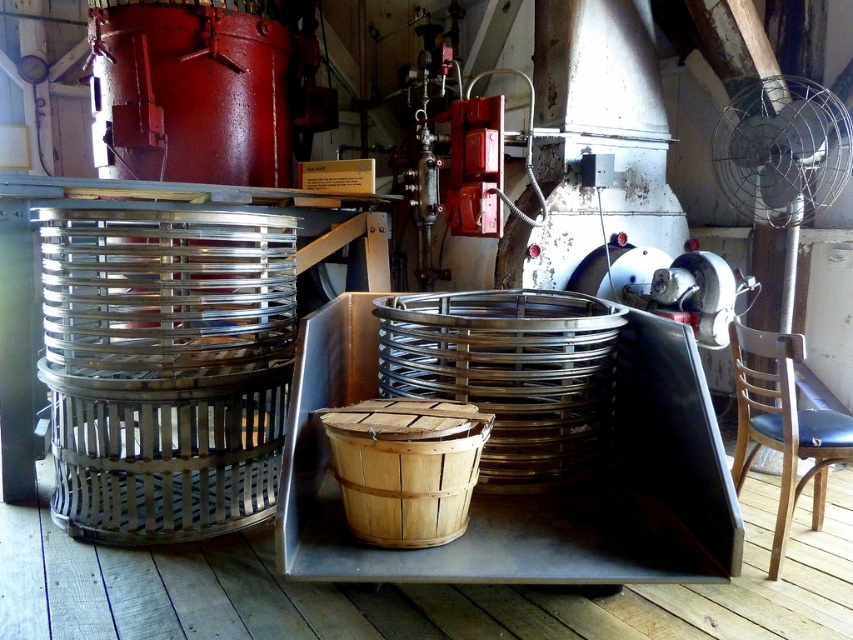
You are standing in front of the industrial machinery exhibit and notice two points marked in the scene. The first point is at coordinates point [456,429] and the second is at point [788,422]. Which of these two points is closer to you?

Point [456,429] is in front of point [788,422], so it is closer to you.

Based on the photo, you are a maintenance worker in the industrial exhibit and need to reach the metallic wire mesh fan at upper right to clean it. You have a ladder that is 1.2 meters long. The brown wooden chair at right is nearby. Can you use the chair to safely reach the fan?

The metallic wire mesh fan at upper right is 1.28 meters away from the brown wooden chair at right. Since the ladder is 1.2 meters long, it is 8 centimeters shorter than the required distance. Therefore, the ladder cannot safely reach the fan from the chair.

You are an engineer inspecting the industrial machinery. You notice the metallic wire mesh fan at upper right and the brown wooden chair at right. Which object is shorter in height?

The metallic wire mesh fan at upper right is not as tall as the brown wooden chair at right, so the metallic wire mesh fan at upper right is shorter in height.